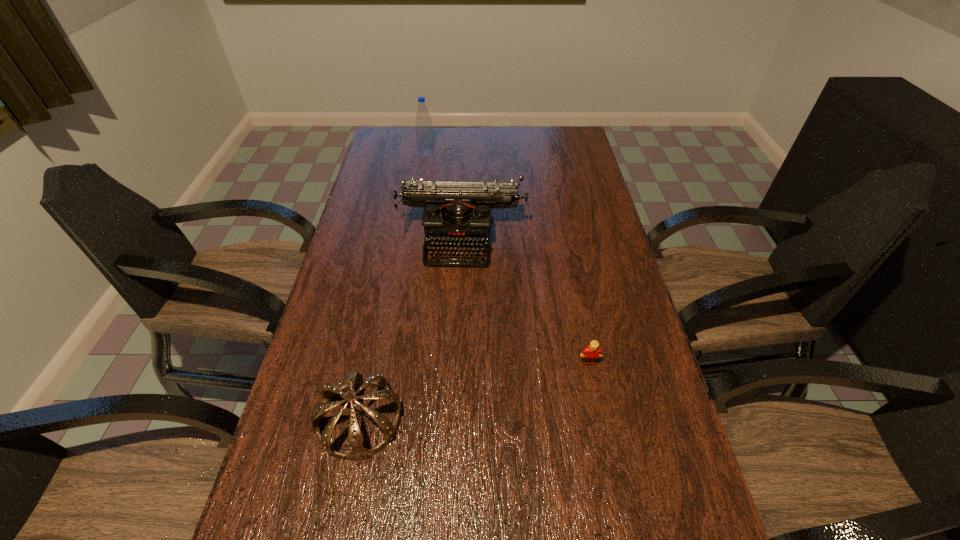
You are a GUI agent. You are given a task and a screenshot of the screen. Output one action in this format:
    pyautogui.click(x=<x>, y=<y>)
    Task: Click on the empty space that is in between the tiara and the shortest object
    
    Given the screenshot: What is the action you would take?
    pyautogui.click(x=474, y=392)

Identify the location of vacant area between the Lego and the farthest object. This screenshot has width=960, height=540. (508, 258).

You are a GUI agent. You are given a task and a screenshot of the screen. Output one action in this format:
    pyautogui.click(x=<x>, y=<y>)
    Task: Click on the free space between the shortest object and the water bottle
    This screenshot has width=960, height=540.
    Given the screenshot: What is the action you would take?
    pyautogui.click(x=508, y=258)

This screenshot has width=960, height=540. What are the coordinates of `empty space between the rightmost object and the third nearest object` in the screenshot? It's located at (525, 300).

Where is `vacant area between the Lego and the tiara`? vacant area between the Lego and the tiara is located at coordinates (474, 392).

The image size is (960, 540). Find the location of `free space between the tiara and the rightmost object`. free space between the tiara and the rightmost object is located at coordinates (474, 392).

Identify the location of vacant space in between the rightmost object and the tiara. (474, 392).

Where is `free space that is in between the tallest object and the third farthest object`? free space that is in between the tallest object and the third farthest object is located at coordinates (508, 258).

Locate an element on the screen. free space between the Lego and the water bottle is located at coordinates (508, 258).

The image size is (960, 540). In order to click on vacant space that's between the Lego and the typewriter in this screenshot , I will do `click(525, 300)`.